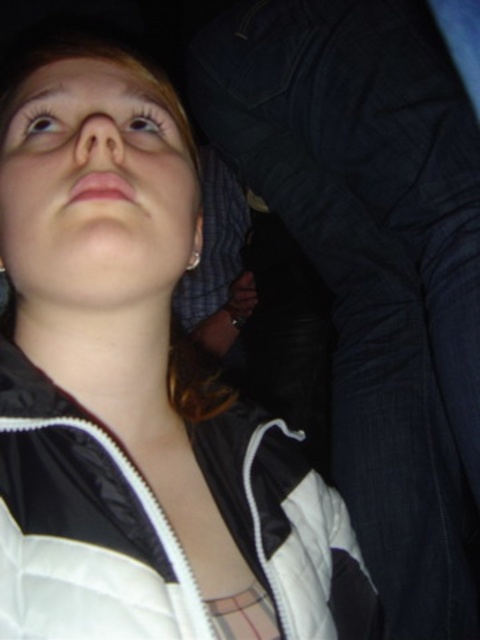
Does light brown eye at upper left have a lesser width compared to shiny brown eye at upper left?

No.

Which is more to the left, light brown eye at upper left or shiny brown eye at upper left?

light brown eye at upper left is more to the left.

Is point (44, 109) behind point (146, 116)?

No.

Image resolution: width=480 pixels, height=640 pixels. In order to click on light brown eye at upper left in this screenshot , I will do `click(43, 124)`.